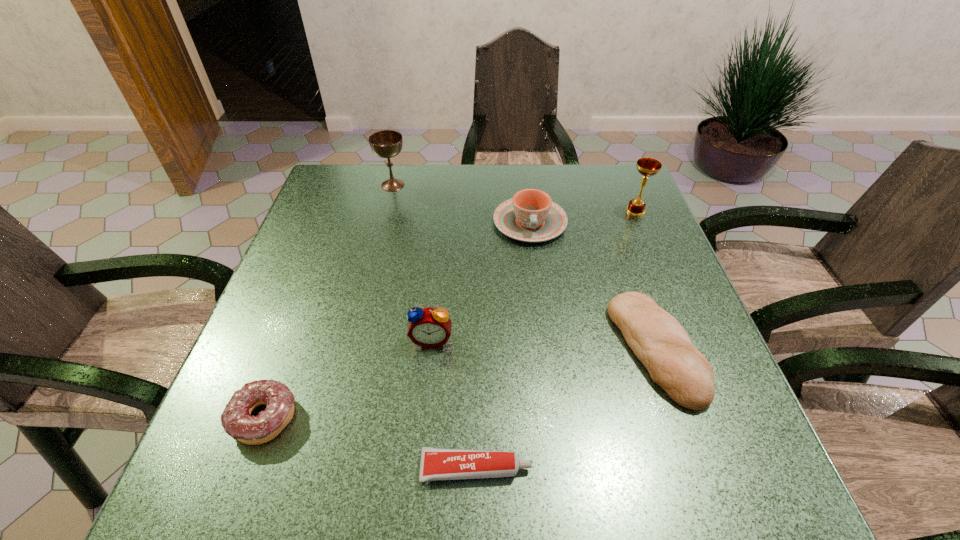
Where is `free spot located on the front of the second object from left to right`? Image resolution: width=960 pixels, height=540 pixels. free spot located on the front of the second object from left to right is located at coordinates (378, 244).

Find the location of a particular element. The image size is (960, 540). blank space located on the front of the nearer chalice is located at coordinates (688, 338).

This screenshot has width=960, height=540. In order to click on free spot located on the front-facing side of the alarm clock in this screenshot , I will do `click(425, 408)`.

The width and height of the screenshot is (960, 540). In order to click on vacant space situated on the handle side of the chinaware in this screenshot , I will do `click(535, 263)`.

This screenshot has width=960, height=540. Find the location of `vacant space located 0.130m on the back of the third shortest object`. vacant space located 0.130m on the back of the third shortest object is located at coordinates pos(624,259).

Where is `vacant space located on the front of the sixth tallest object`? vacant space located on the front of the sixth tallest object is located at coordinates (231, 507).

Find the location of `vacant space situated at the nozzle of the shortest object`. vacant space situated at the nozzle of the shortest object is located at coordinates (740, 469).

The width and height of the screenshot is (960, 540). Identify the location of chinaware present at the far edge. (530, 216).

Where is `object that is positioned at the near edge`? object that is positioned at the near edge is located at coordinates (436, 464).

Image resolution: width=960 pixels, height=540 pixels. What are the coordinates of `chalice present at the left edge` in the screenshot? It's located at (386, 144).